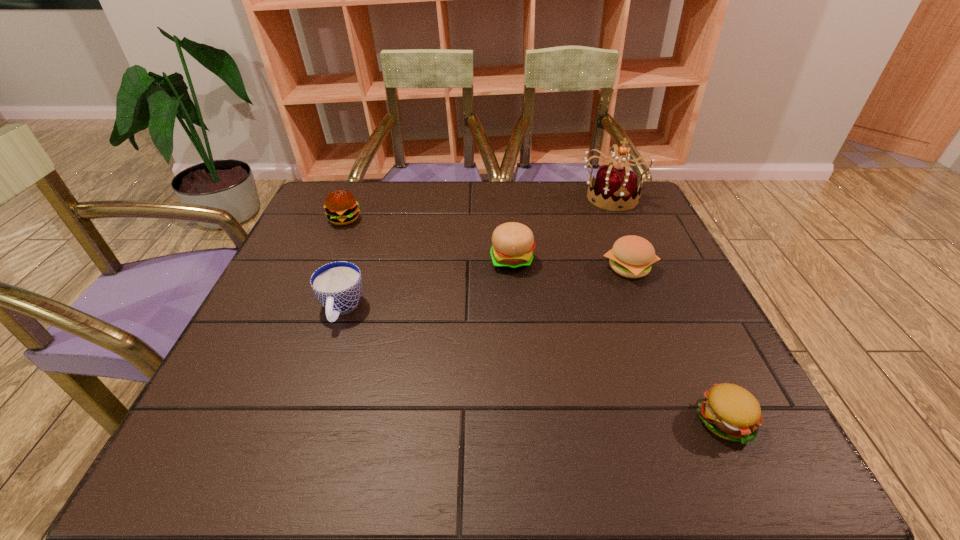
In order to click on tiara in this screenshot , I will do `click(614, 189)`.

Find the location of a particular element. Image resolution: width=960 pixels, height=540 pixels. the second hamburger from left to right is located at coordinates point(513,243).

Locate an element on the screen. This screenshot has width=960, height=540. the farthest hamburger is located at coordinates (341, 207).

You are a GUI agent. You are given a task and a screenshot of the screen. Output one action in this format:
    pyautogui.click(x=<x>, y=<y>)
    Task: Click on the second nearest object
    The height and width of the screenshot is (540, 960).
    Given the screenshot: What is the action you would take?
    tap(337, 285)

Identify the location of the nearest hamburger. (729, 411).

This screenshot has width=960, height=540. Identify the location of the nearest object. (729, 411).

At what (x,y) coordinates should I click in order to perform the action: click on vacant point located on the front-facing side of the tiara. Please return your answer as a coordinate pair (x, y). This screenshot has height=540, width=960. Looking at the image, I should click on (654, 293).

Locate an element on the screen. This screenshot has height=540, width=960. free space located on the front of the fourth object from right to left is located at coordinates (526, 430).

At what (x,y) coordinates should I click in order to perform the action: click on blank space located on the right of the leftmost hamburger. Please return your answer as a coordinate pair (x, y). Image resolution: width=960 pixels, height=540 pixels. Looking at the image, I should click on (456, 220).

I want to click on free space located on the side of the fifth farthest object with the handle, so click(311, 401).